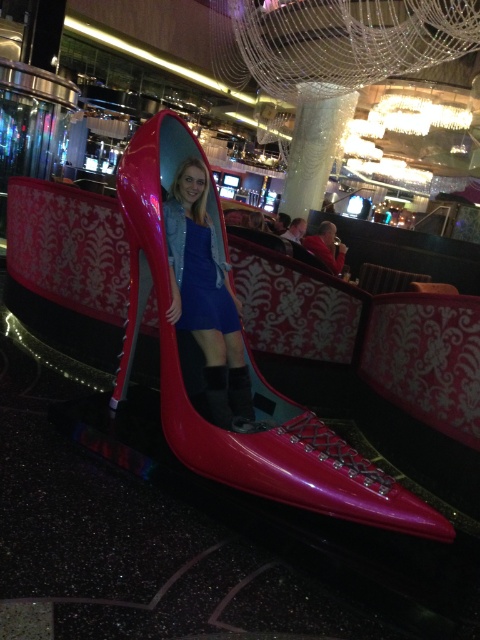
How distant is matte blue dress at center from shiny patent leather shoe at center?

matte blue dress at center and shiny patent leather shoe at center are 20.26 centimeters apart.

Does matte blue dress at center have a lesser width compared to shiny patent leather shoe at center?

No, matte blue dress at center is not thinner than shiny patent leather shoe at center.

I want to click on matte blue dress at center, so [x=206, y=298].

Locate an element on the screen. Image resolution: width=480 pixels, height=640 pixels. matte blue dress at center is located at coordinates (206, 298).